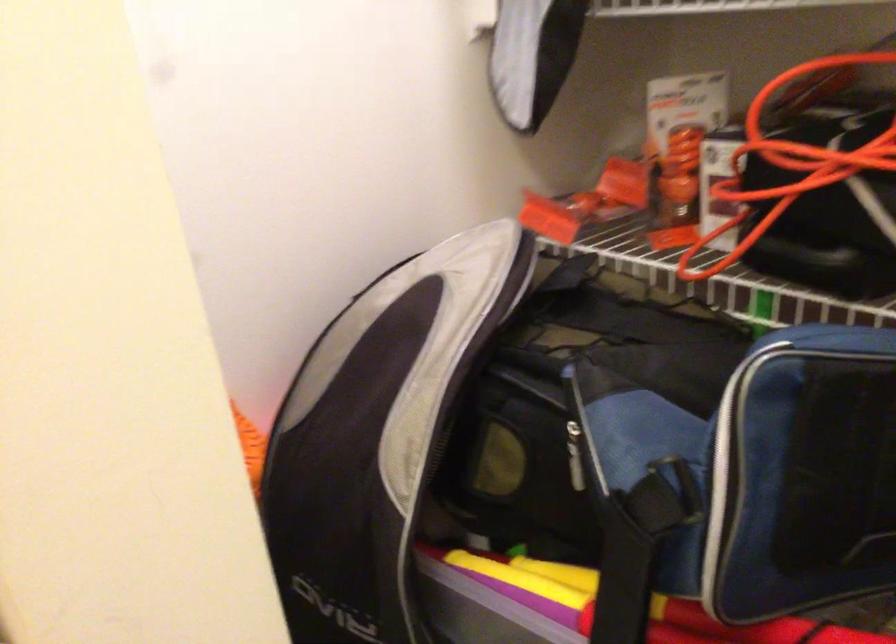
Locate an element on the screen. metal zipper pull is located at coordinates (574, 456).